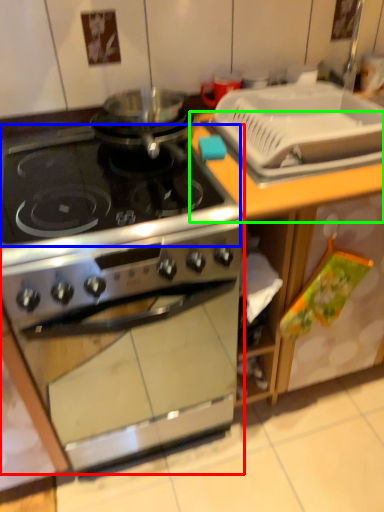
Question: Which object is positioned closest to kitchen appliance (highlighted by a red box)? Select from gas stove (highlighted by a blue box) and counter top (highlighted by a green box).

Choices:
 (A) gas stove
 (B) counter top

Answer: (A)